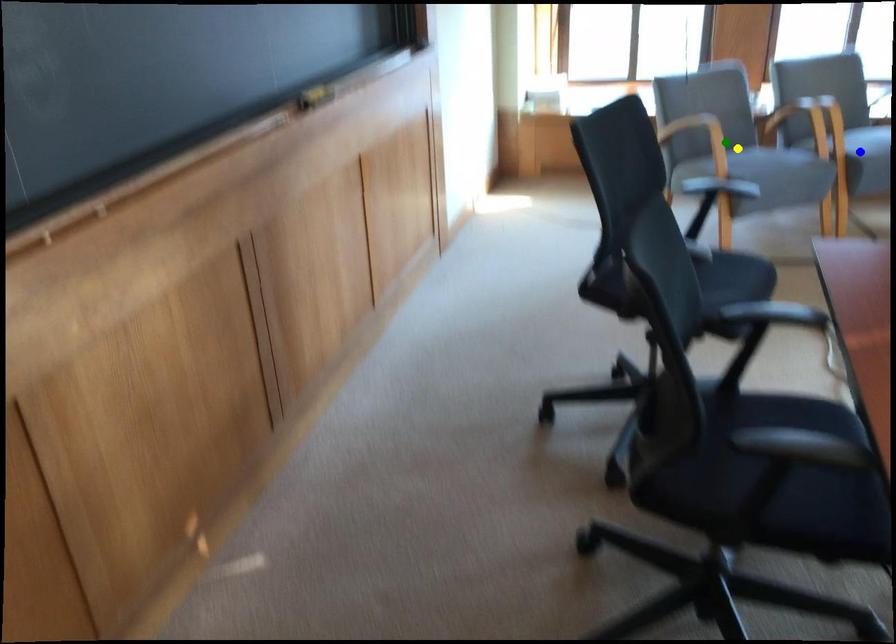
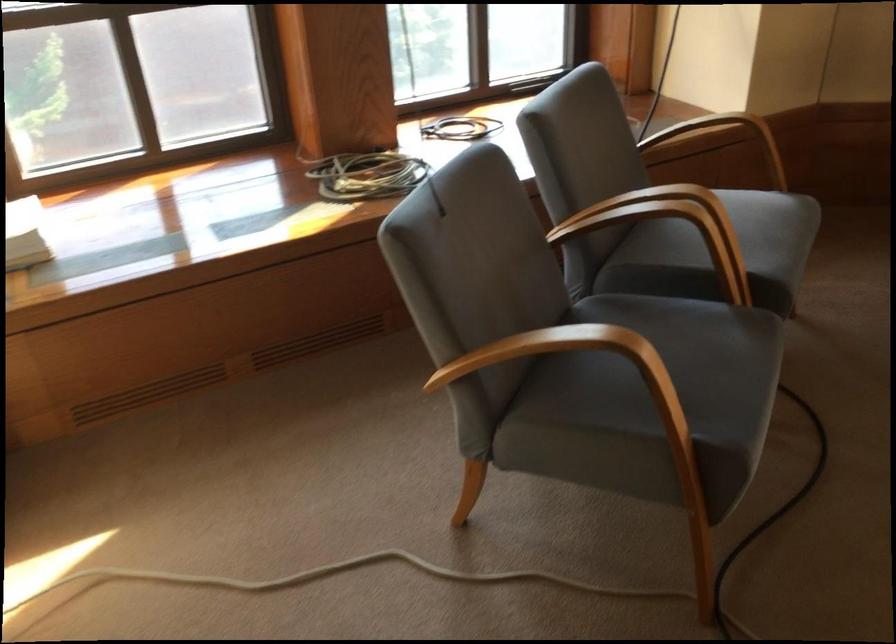
I am providing you with two images of the same scene from different viewpoints. Three points are marked in image1. Which point corresponds to a part or object that is occluded in image2?In image1, three points are marked. Which of them correspond to a part or object that is occluded in image2?Among the three points shown in image1, which one corresponds to a part or object that is no longer visible due to occlusion in image2?

Invisible in image2: blue point.